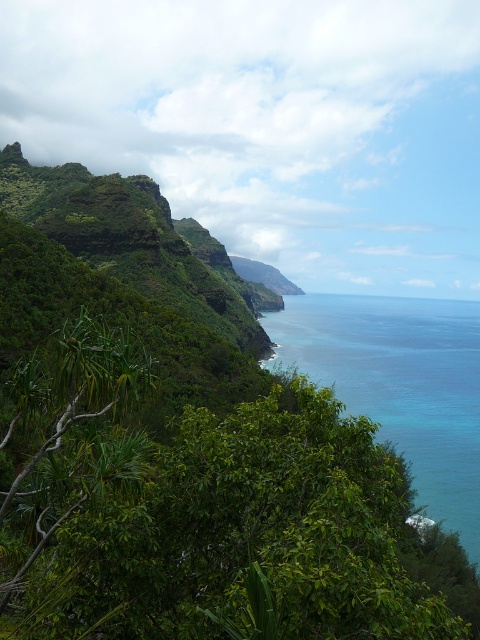
Question: Does green leafy foliage at lower left lie behind blue clear water at center?

Choices:
 (A) yes
 (B) no

Answer: (B)

Question: Which of the following is the closest to the observer?

Choices:
 (A) green leafy foliage at lower left
 (B) blue clear water at center

Answer: (A)

Question: Is green leafy foliage at lower left to the right of blue clear water at center from the viewer's perspective?

Choices:
 (A) no
 (B) yes

Answer: (B)

Question: Among these points, which one is farthest from the camera?

Choices:
 (A) (406, 376)
 (B) (397, 435)

Answer: (A)

Question: Can you confirm if green leafy foliage at lower left is wider than blue clear water at center?

Choices:
 (A) no
 (B) yes

Answer: (A)

Question: Which point is farther to the camera?

Choices:
 (A) click(408, 426)
 (B) click(395, 330)

Answer: (B)